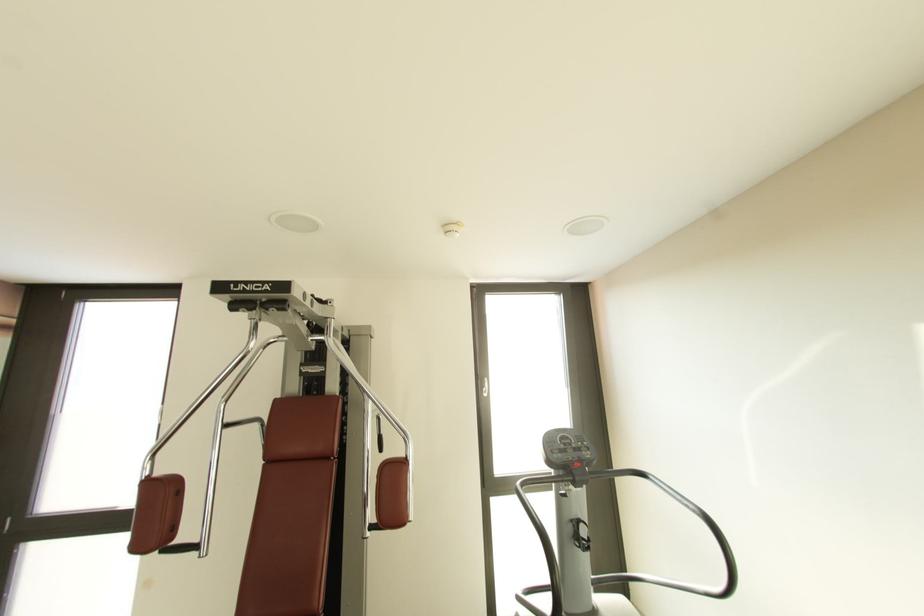
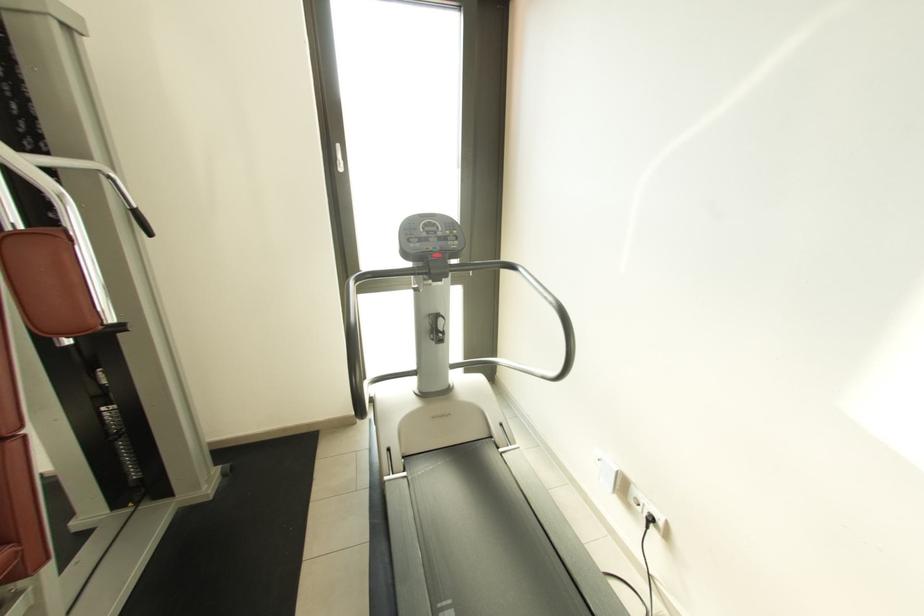
Where in the second image is the point corresponding to pixel 575 531 from the first image?

(432, 325)